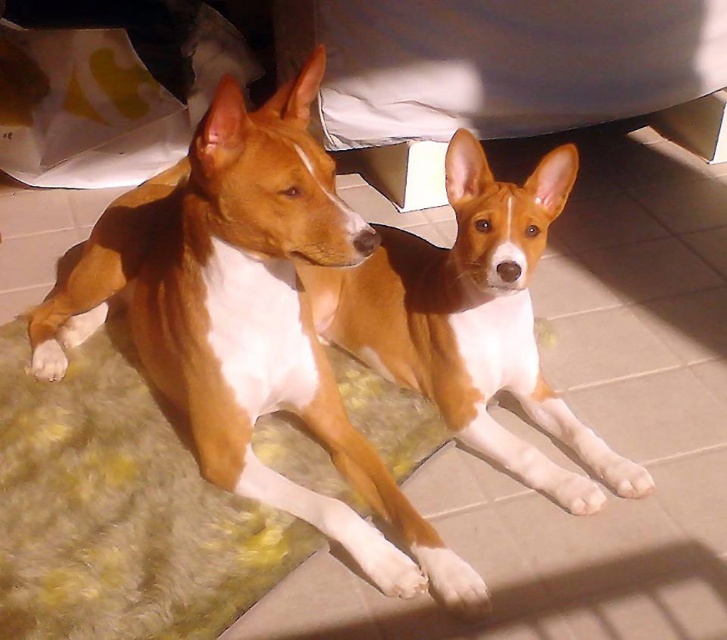
You are a photographer trying to capture a photo of the brown shiny fur dog at center and the yellow fuzzy mat at lower left. If you want to ensure both subjects are fully visible in the frame, which one should you adjust your camera angle to focus on first?

The brown shiny fur dog at center is wider than the yellow fuzzy mat at lower left, so you should focus on the brown shiny fur dog at center first to ensure it fits in the frame before adjusting for the smaller mat.